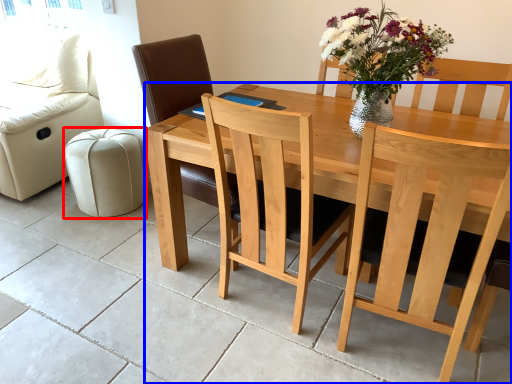
Question: Which of the following is the farthest to the observer, stool (highlighted by a red box) or table (highlighted by a blue box)?

Choices:
 (A) stool
 (B) table

Answer: (A)